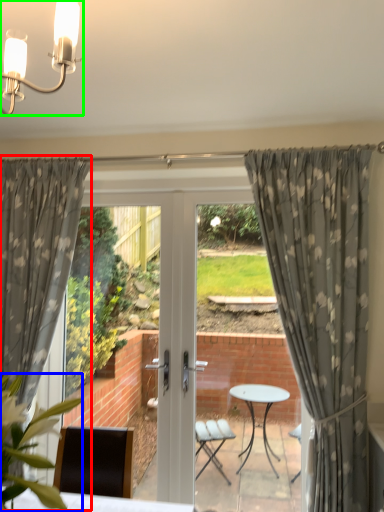
Question: Which is farther away from curtain (highlighted by a red box)? plant (highlighted by a blue box) or light fixture (highlighted by a green box)?

Choices:
 (A) plant
 (B) light fixture

Answer: (B)